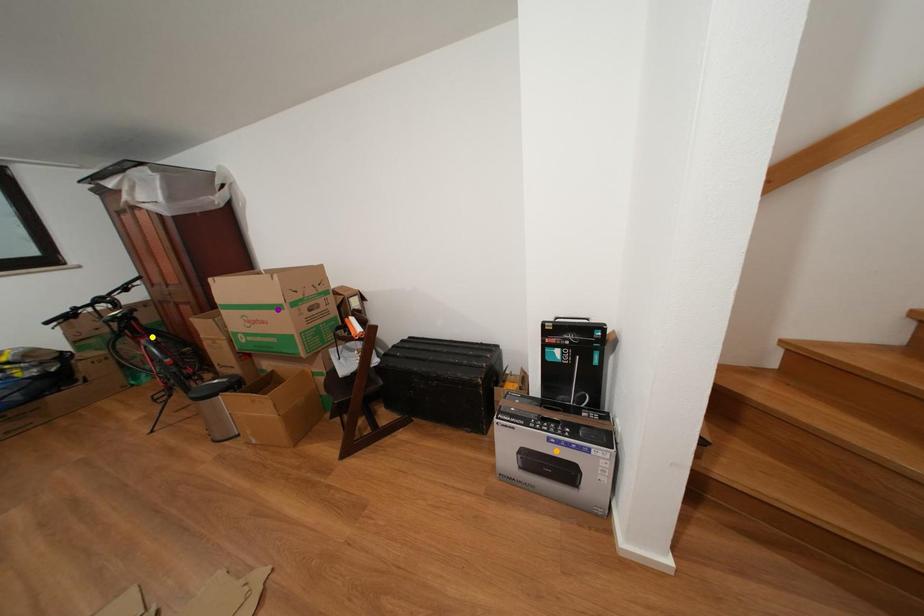
Order these from farthest to nearest:
- yellow point
- orange point
- purple point

yellow point, purple point, orange point